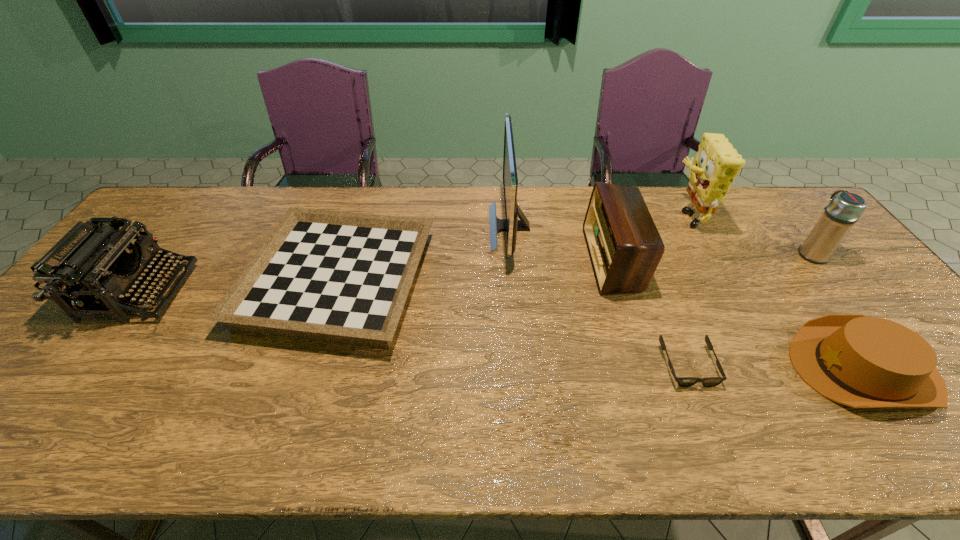
The image size is (960, 540). What are the coordinates of `the third object from left to right` in the screenshot? It's located at (511, 224).

This screenshot has width=960, height=540. I want to click on the third object from right to left, so click(717, 163).

Identify the location of thermos bottle. (844, 210).

The width and height of the screenshot is (960, 540). Identify the location of the leftmost object. (88, 269).

Locate an element on the screen. Image resolution: width=960 pixels, height=540 pixels. radio receiver is located at coordinates (624, 245).

This screenshot has width=960, height=540. I want to click on checkerboard, so click(343, 277).

This screenshot has width=960, height=540. In order to click on the second object from left to right in this screenshot , I will do `click(343, 277)`.

The image size is (960, 540). Find the location of `sunglasses`. sunglasses is located at coordinates (682, 381).

The image size is (960, 540). What are the coordinates of `vacant space situated on the screen side of the sixth object from right to left` in the screenshot? It's located at (437, 227).

Find the location of a particular element. vacant region located 0.400m on the screen side of the sixth object from right to left is located at coordinates (365, 227).